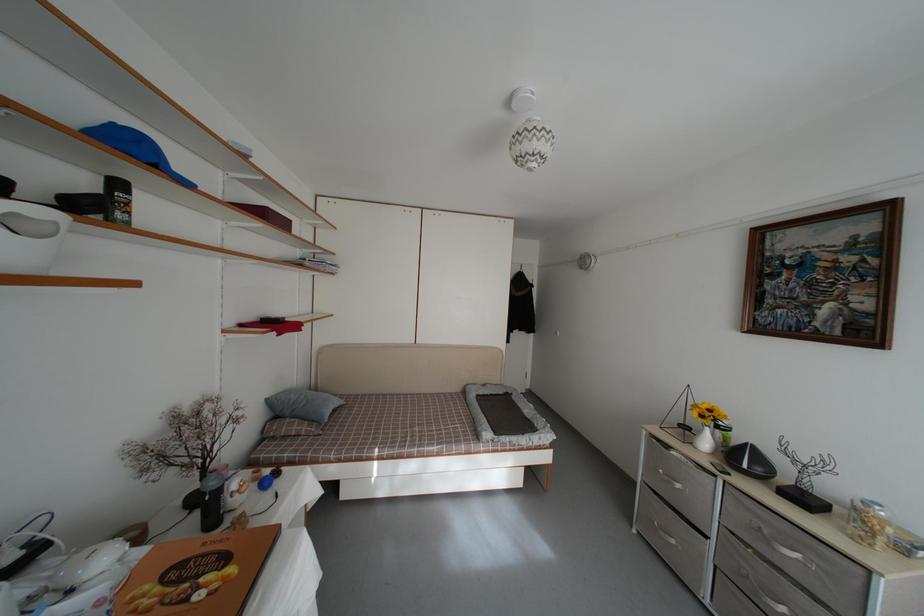
This screenshot has height=616, width=924. Find the location of `brown candy box`. brown candy box is located at coordinates (197, 575).